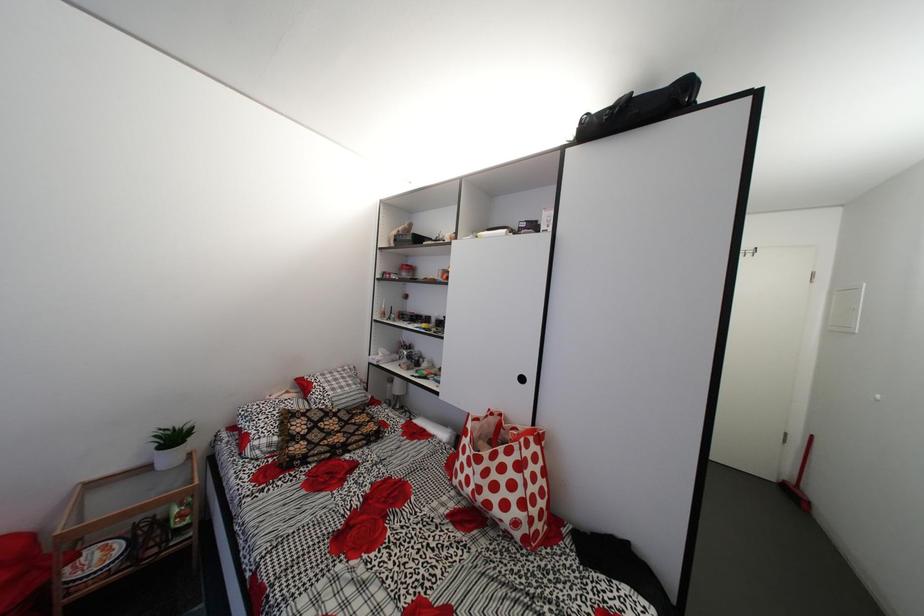
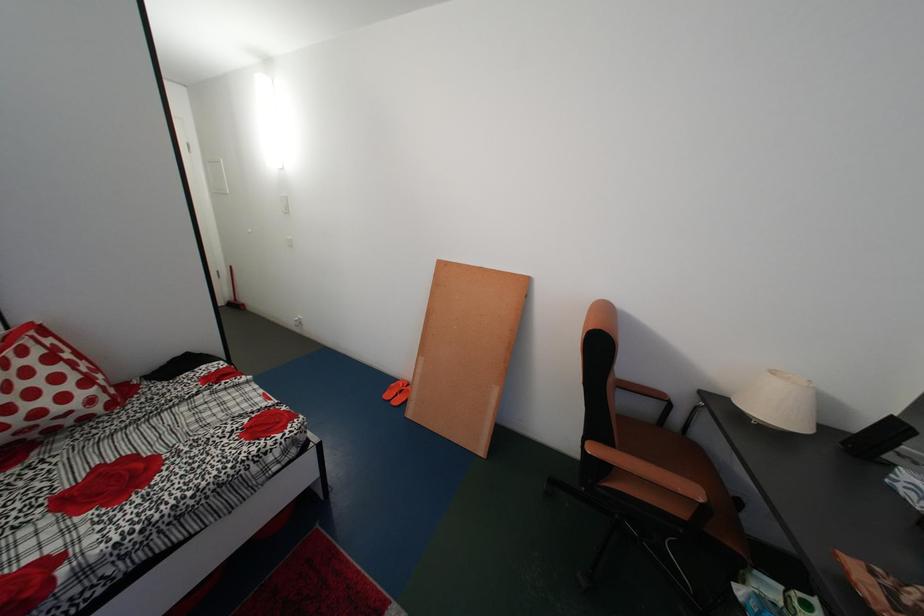
The first image is from the beginning of the video and the second image is from the end. How did the camera likely rotate when shooting the video?

The camera rotated toward right-down.